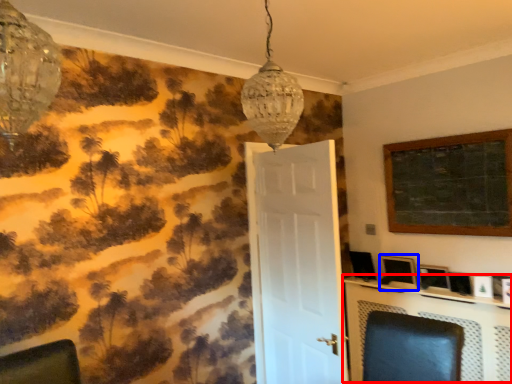
Question: Which of the following is the farthest to the observer, table (highlighted by a red box) or picture frame (highlighted by a blue box)?

Choices:
 (A) table
 (B) picture frame

Answer: (B)